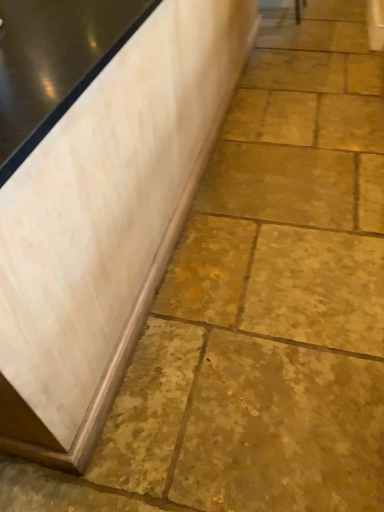
The width and height of the screenshot is (384, 512). What do you see at coordinates (106, 222) in the screenshot? I see `matte wood cabinet at lower left` at bounding box center [106, 222].

The width and height of the screenshot is (384, 512). I want to click on matte wood cabinet at lower left, so click(106, 222).

The width and height of the screenshot is (384, 512). Find the location of `matte wood cabinet at lower left`. matte wood cabinet at lower left is located at coordinates (106, 222).